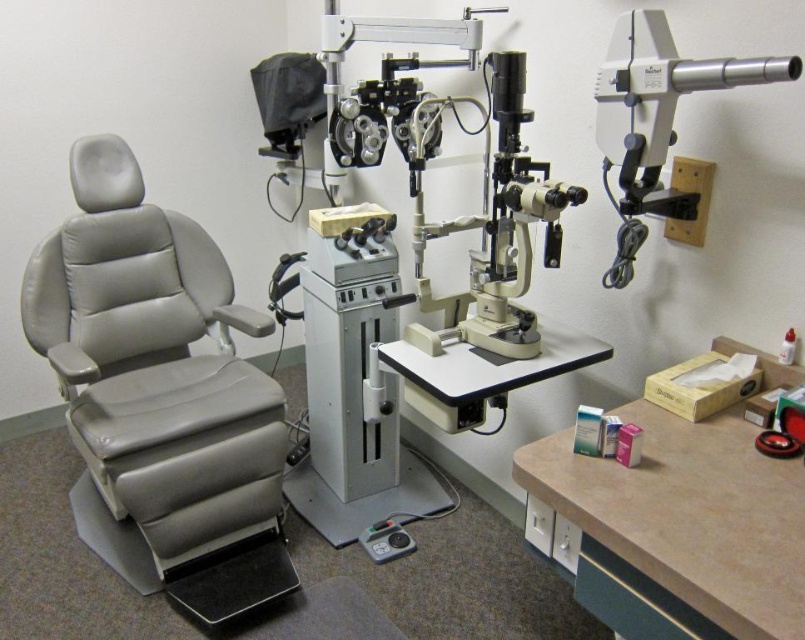
Question: Among these points, which one is farthest from the camera?

Choices:
 (A) (687, 218)
 (B) (166, 449)

Answer: (B)

Question: Is gray leather swivel chair at left above beige laminate table at lower right?

Choices:
 (A) yes
 (B) no

Answer: (A)

Question: Where is gray leather swivel chair at left located in relation to beige laminate table at lower right in the image?

Choices:
 (A) right
 (B) left

Answer: (B)

Question: Estimate the real-world distances between objects in this image. Which object is farther from the white plastic telescope at upper right?

Choices:
 (A) beige laminate table at lower right
 (B) gray leather swivel chair at left

Answer: (B)

Question: Which point is farther to the camera?

Choices:
 (A) beige laminate table at lower right
 (B) gray leather swivel chair at left

Answer: (B)

Question: Does gray leather swivel chair at left appear under white plastic telescope at upper right?

Choices:
 (A) no
 (B) yes

Answer: (B)